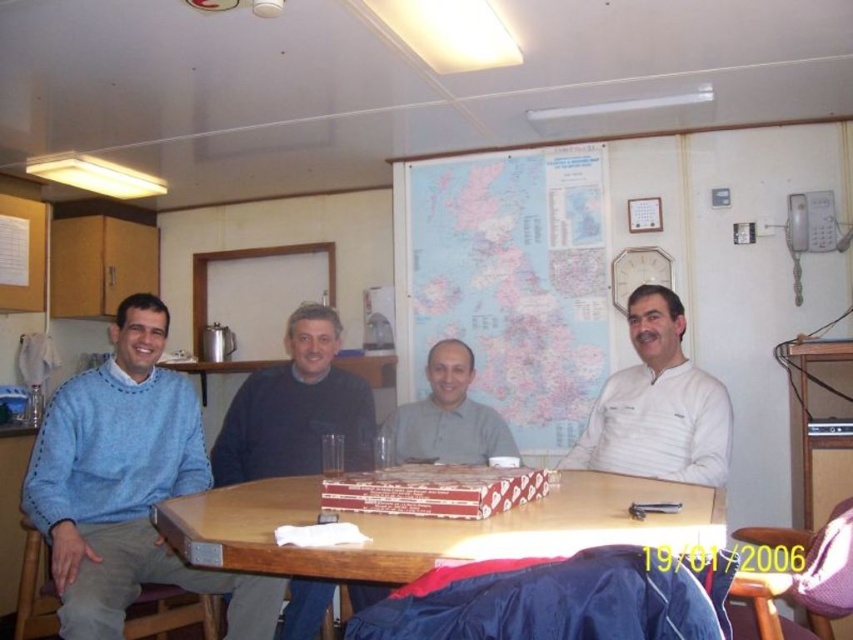
Does white matte shirt at center have a lesser width compared to red cardboard pizza boxes at center?

Correct, white matte shirt at center's width is less than red cardboard pizza boxes at center's.

From the picture: Is white matte shirt at center positioned in front of red cardboard pizza boxes at center?

No, white matte shirt at center is further to the viewer.

Describe the element at coordinates (657, 404) in the screenshot. I see `white matte shirt at center` at that location.

The image size is (853, 640). In order to click on white matte shirt at center in this screenshot , I will do `click(657, 404)`.

Between map paper at center and white matte shirt at center, which one has more height?

With more height is map paper at center.

Does map paper at center have a smaller size compared to white matte shirt at center?

Actually, map paper at center might be larger than white matte shirt at center.

Describe the element at coordinates (509, 280) in the screenshot. I see `map paper at center` at that location.

The width and height of the screenshot is (853, 640). I want to click on map paper at center, so click(509, 280).

Does dark blue sweater at center appear on the left side of red cardboard pizza boxes at center?

Yes, dark blue sweater at center is to the left of red cardboard pizza boxes at center.

Between dark blue sweater at center and red cardboard pizza boxes at center, which one appears on the left side from the viewer's perspective?

Positioned to the left is dark blue sweater at center.

At what (x,y) coordinates should I click in order to perform the action: click on dark blue sweater at center. Please return your answer as a coordinate pair (x, y). Looking at the image, I should click on 296,408.

Find the location of `dark blue sweater at center`. dark blue sweater at center is located at coordinates (296, 408).